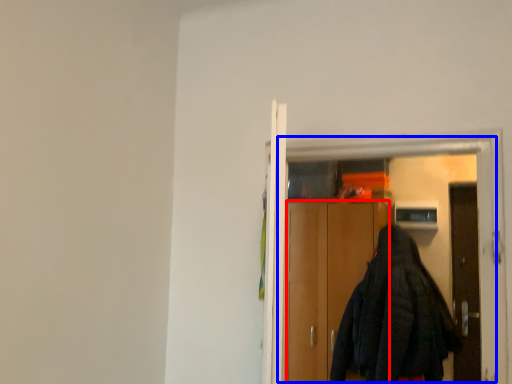
Question: Which object appears farthest to the camera in this image, cabinetry (highlighted by a red box) or elevator (highlighted by a blue box)?

Choices:
 (A) cabinetry
 (B) elevator

Answer: (A)